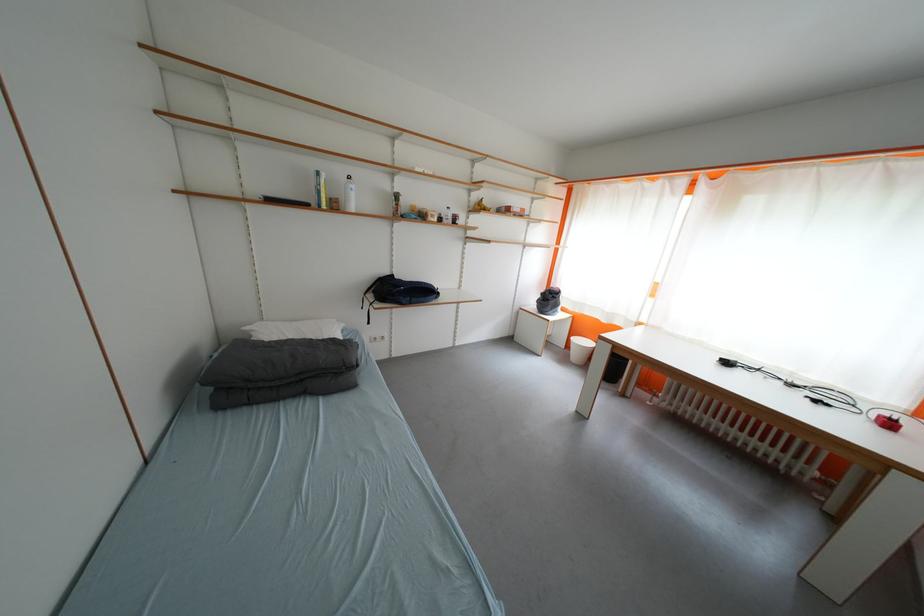
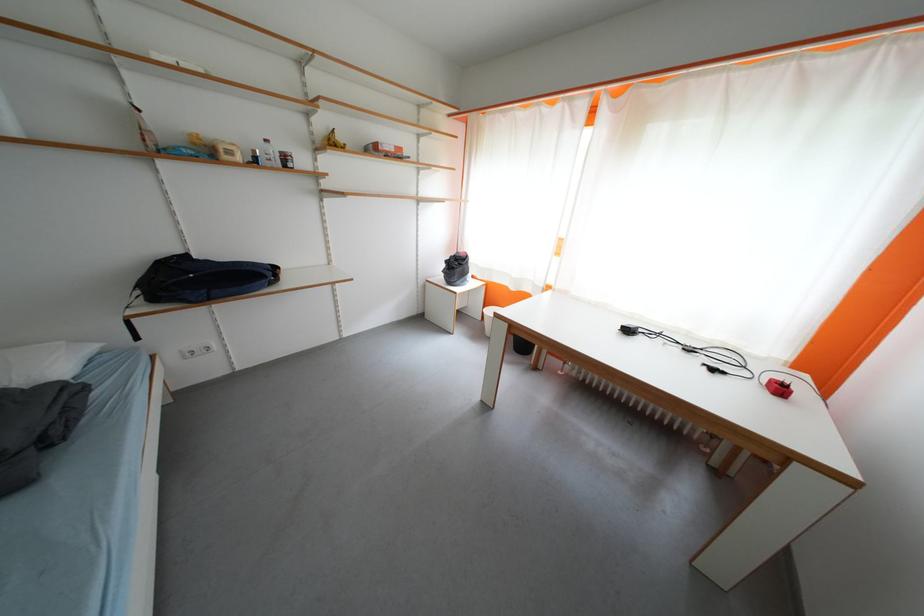
Question: The images are taken continuously from a first-person perspective. In which direction is your viewpoint rotating?

Choices:
 (A) Left
 (B) Right
 (C) Up
 (D) Down

Answer: (B)